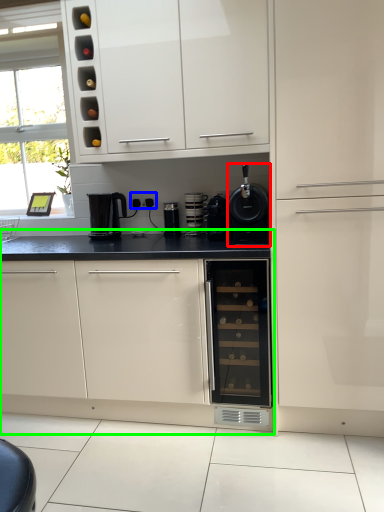
Question: Which is farther away from kitchen appliance (highlighted by a red box)? electric outlet (highlighted by a blue box) or cabinetry (highlighted by a green box)?

Choices:
 (A) electric outlet
 (B) cabinetry

Answer: (B)